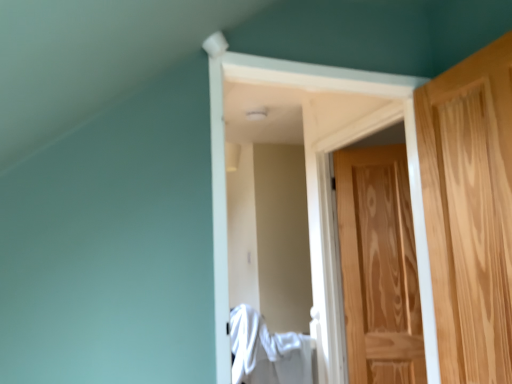
Question: Would you say natural wood door at right, which appears as the 1th door when viewed from the back, is outside white fabric at center?

Choices:
 (A) yes
 (B) no

Answer: (A)

Question: Considering the relative positions of natural wood door at right, which appears as the 1th door when viewed from the back, and white fabric at center in the image provided, is natural wood door at right, which appears as the 1th door when viewed from the back, in front of white fabric at center?

Choices:
 (A) no
 (B) yes

Answer: (A)

Question: Are natural wood door at right, which appears as the 1th door when viewed from the back, and white fabric at center far apart?

Choices:
 (A) yes
 (B) no

Answer: (B)

Question: Would you say natural wood door at right, which appears as the 1th door when viewed from the back, contains white fabric at center?

Choices:
 (A) no
 (B) yes

Answer: (A)

Question: Can you confirm if natural wood door at right, which appears as the 1th door when viewed from the back, is taller than white fabric at center?

Choices:
 (A) yes
 (B) no

Answer: (A)

Question: In the image, is white fabric at center positioned in front of or behind natural wood door at right, which is the second door from front to back?

Choices:
 (A) behind
 (B) front

Answer: (B)

Question: Would you say white fabric at center is to the left or to the right of natural wood door at right, which is the second door from front to back, in the picture?

Choices:
 (A) left
 (B) right

Answer: (A)

Question: Is white fabric at center taller or shorter than natural wood door at right, which appears as the 1th door when viewed from the back?

Choices:
 (A) tall
 (B) short

Answer: (B)

Question: From a real-world perspective, relative to natural wood door at right, which is the second door from front to back, is white fabric at center vertically above or below?

Choices:
 (A) below
 (B) above

Answer: (A)

Question: Is light brown wood door at right, the second door positioned from the back, in front of or behind natural wood door at right, which appears as the 1th door when viewed from the back, in the image?

Choices:
 (A) behind
 (B) front

Answer: (B)

Question: From a real-world perspective, is light brown wood door at right, positioned as the 1th door in front-to-back order, positioned above or below natural wood door at right, which appears as the 1th door when viewed from the back?

Choices:
 (A) below
 (B) above

Answer: (B)

Question: Which is correct: light brown wood door at right, positioned as the 1th door in front-to-back order, is inside natural wood door at right, which is the second door from front to back, or outside of it?

Choices:
 (A) inside
 (B) outside

Answer: (B)

Question: Is point (445, 354) positioned closer to the camera than point (394, 349)?

Choices:
 (A) closer
 (B) farther

Answer: (A)

Question: From their relative heights in the image, would you say natural wood door at right, which appears as the 1th door when viewed from the back, is taller or shorter than white fabric at center?

Choices:
 (A) tall
 (B) short

Answer: (A)

Question: Choose the correct answer: Is natural wood door at right, which is the second door from front to back, inside white fabric at center or outside it?

Choices:
 (A) outside
 (B) inside

Answer: (A)